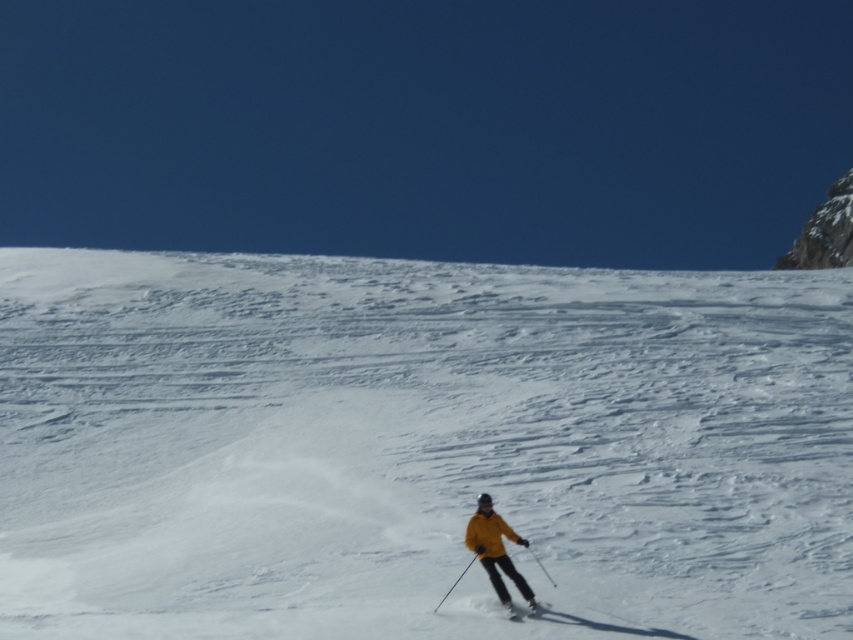
Question: Which of the following is the farthest from the observer?

Choices:
 (A) (404, 372)
 (B) (523, 596)

Answer: (A)

Question: Which point appears closest to the camera in this image?

Choices:
 (A) (281, 632)
 (B) (529, 605)
 (C) (520, 588)

Answer: (A)

Question: Is white powder snow at center wider than yellow matte jacket at center?

Choices:
 (A) yes
 (B) no

Answer: (A)

Question: Is yellow matte jacket at center further to camera compared to shiny metallic ski at center?

Choices:
 (A) no
 (B) yes

Answer: (B)

Question: Which point is farther to the camera?

Choices:
 (A) yellow matte jacket at center
 (B) shiny metallic ski at center
 (C) white powder snow at center

Answer: (A)

Question: Can you confirm if white powder snow at center is thinner than shiny metallic ski at center?

Choices:
 (A) yes
 (B) no

Answer: (B)